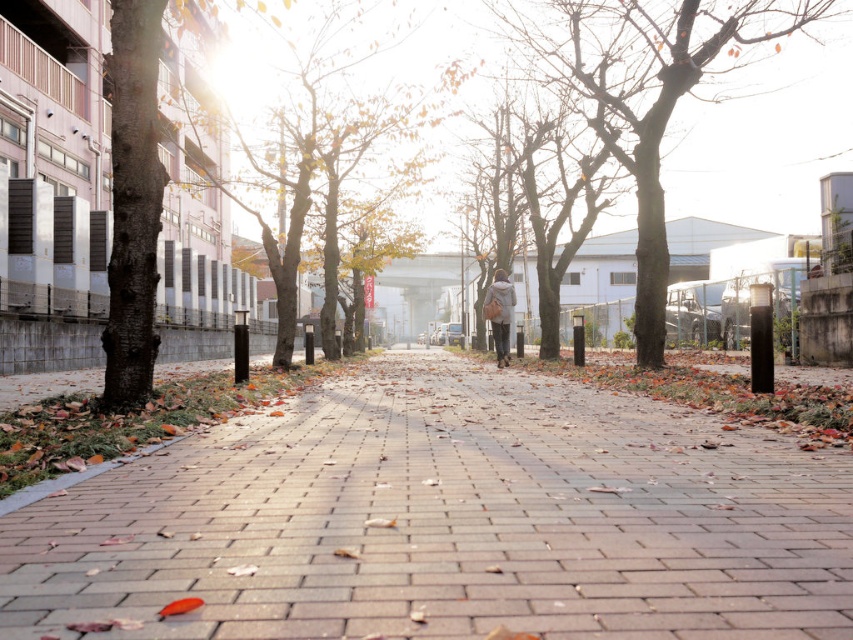
Who is positioned more to the left, brick pavement at center or bare wood tree at center?

Positioned to the left is brick pavement at center.

Who is positioned more to the right, brick pavement at center or bare wood tree at center?

bare wood tree at center

Find the location of a particular element. This screenshot has height=640, width=853. brick pavement at center is located at coordinates (445, 520).